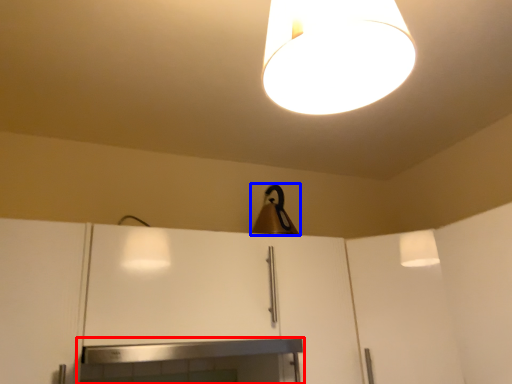
Question: Which point is closer to the camera, fireplace (highlighted by a red box) or lamp (highlighted by a blue box)?

Choices:
 (A) fireplace
 (B) lamp

Answer: (A)